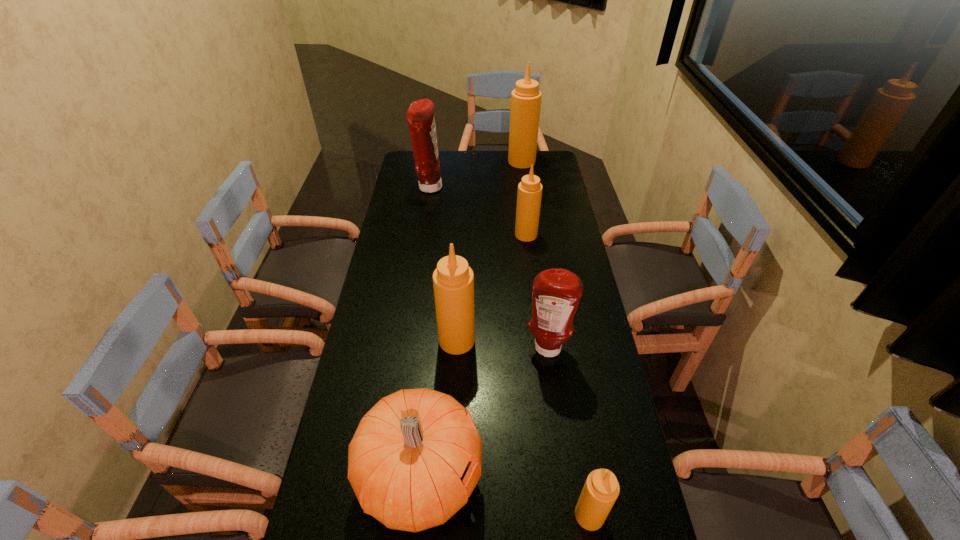
Identify the location of object present at the far right corner. (526, 97).

In the image, there is a desktop. At what (x,y) coordinates should I click in order to perform the action: click on vacant space at the far edge. Please return your answer as a coordinate pair (x, y). The height and width of the screenshot is (540, 960). Looking at the image, I should click on (488, 173).

The height and width of the screenshot is (540, 960). In the image, there is a desktop. Identify the location of free space at the left edge. (411, 234).

The width and height of the screenshot is (960, 540). In the image, there is a desktop. Find the location of `vacant space at the right edge`. vacant space at the right edge is located at coordinates (573, 417).

Locate an element on the screen. vacant space at the far right corner of the desktop is located at coordinates (536, 167).

Find the location of a particular element. vacant area that lies between the right red condiment and the left red condiment is located at coordinates (489, 268).

The width and height of the screenshot is (960, 540). Find the location of `free spot between the leftmost tan condiment and the third farthest object`. free spot between the leftmost tan condiment and the third farthest object is located at coordinates (492, 287).

This screenshot has height=540, width=960. I want to click on blank region between the shortest condiment and the smaller red condiment, so click(568, 432).

You are a GUI agent. You are given a task and a screenshot of the screen. Output one action in this format:
    pyautogui.click(x=<x>, y=<y>)
    Task: Click on the vacant area between the nearer red condiment and the farthest object
    Image resolution: width=960 pixels, height=540 pixels.
    Given the screenshot: What is the action you would take?
    pyautogui.click(x=535, y=255)

Where is `object that stands as the fifth closest to the farthest object`? The image size is (960, 540). object that stands as the fifth closest to the farthest object is located at coordinates (415, 458).